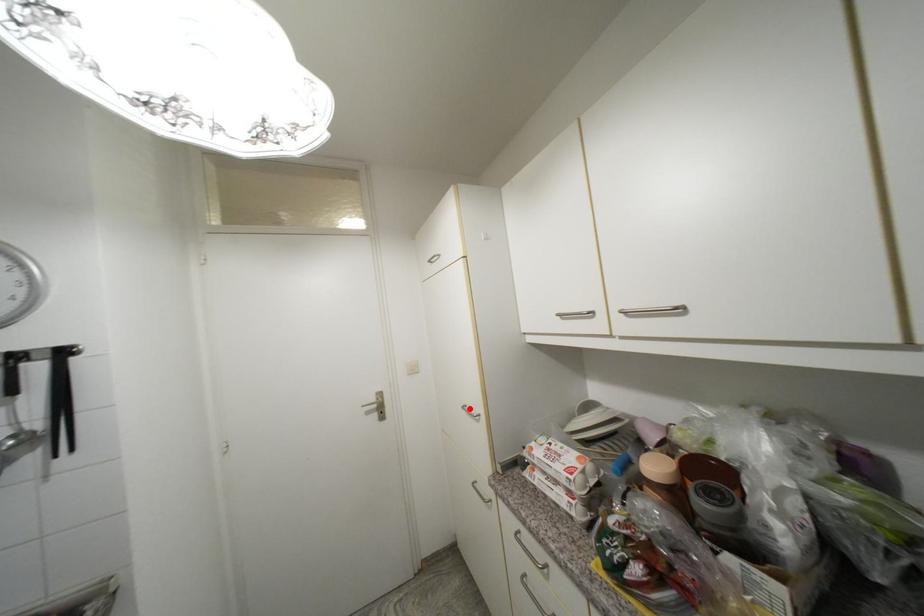
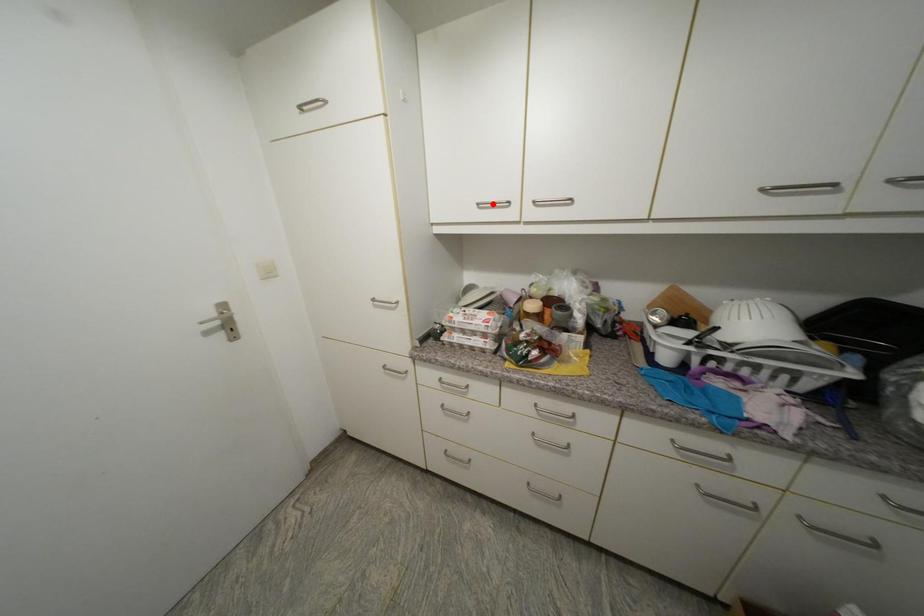
I am providing you with two images of the same scene from different viewpoints. A red point is marked on the first image and another point is marked on the second image. Is the marked point in image1 the same physical position as the marked point in image2?

No